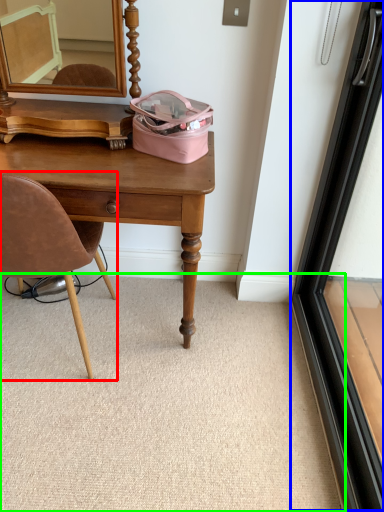
Question: Which is farther away from chair (highlighted by a red box)? screen door (highlighted by a blue box) or plain (highlighted by a green box)?

Choices:
 (A) screen door
 (B) plain

Answer: (A)